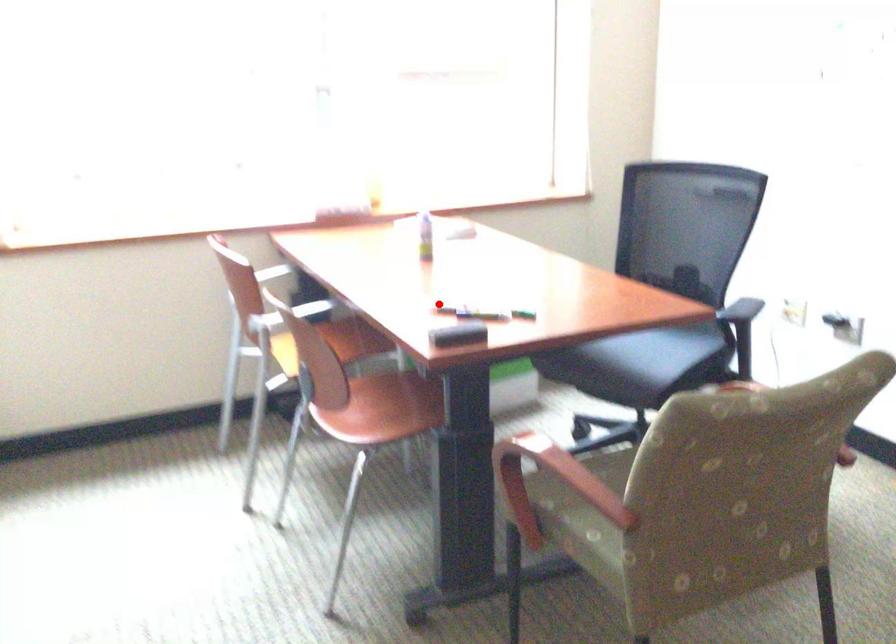
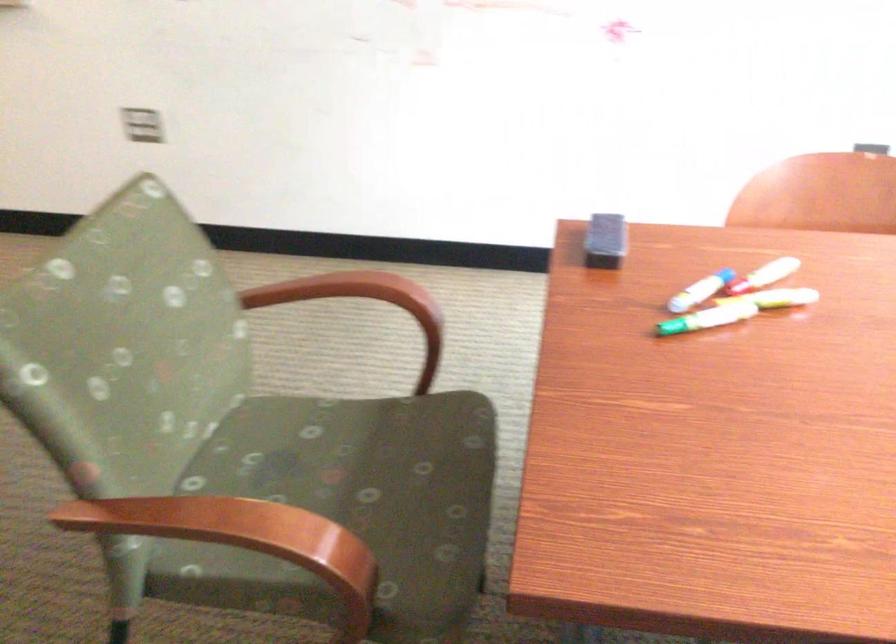
Find the pixel in the second image that matches the highlighted location in the first image.

(773, 270)